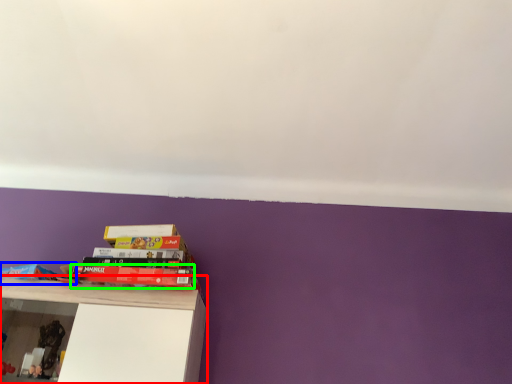
Question: Which object is the farthest from shelf (highlighted by a red box)? Choose among these: book (highlighted by a blue box) or book (highlighted by a green box).

Choices:
 (A) book
 (B) book

Answer: (A)